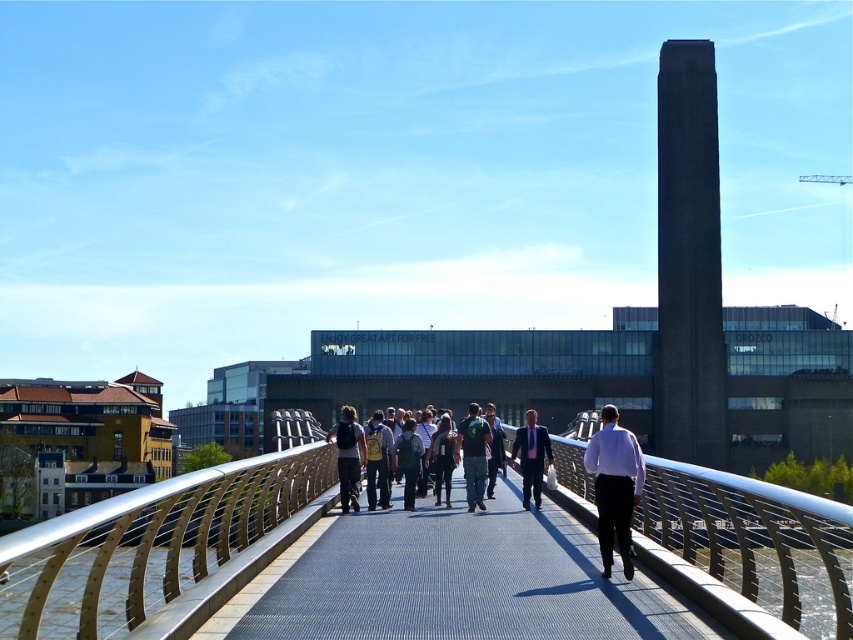
Question: Which of these objects is positioned farthest from the white shirt at center?

Choices:
 (A) green fabric jacket at center
 (B) blue textured pavement at center
 (C) denim jacket at center

Answer: (C)

Question: Considering the real-world distances, which object is closest to the white shirt at center?

Choices:
 (A) matte black backpack at center
 (B) light brown leather jacket at center

Answer: (B)

Question: Can you confirm if light brown leather jacket at center is positioned to the right of dark gray backpack at center?

Choices:
 (A) yes
 (B) no

Answer: (A)

Question: Is metallic silver rail at center to the right of white shirt at center from the viewer's perspective?

Choices:
 (A) yes
 (B) no

Answer: (A)

Question: Can you confirm if matte black backpack at center is thinner than matte black suit at center?

Choices:
 (A) yes
 (B) no

Answer: (A)

Question: Estimate the real-world distances between objects in this image. Which object is closer to the metallic silver rail at center?

Choices:
 (A) satin silver railing at center
 (B) black leather jacket at center
 (C) light brown leather jacket at center

Answer: (B)